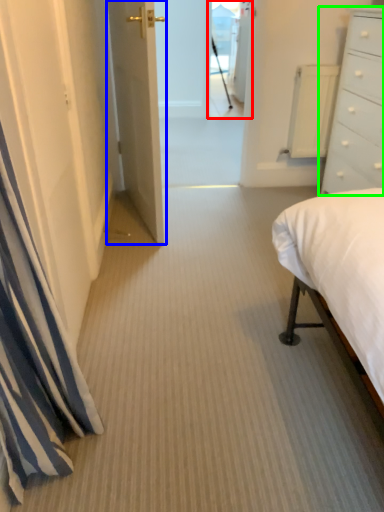
Question: Estimate the real-world distances between objects in this image. Which object is farther from glass door (highlighted by a red box), door (highlighted by a blue box) or chest of drawers (highlighted by a green box)?

Choices:
 (A) door
 (B) chest of drawers

Answer: (B)